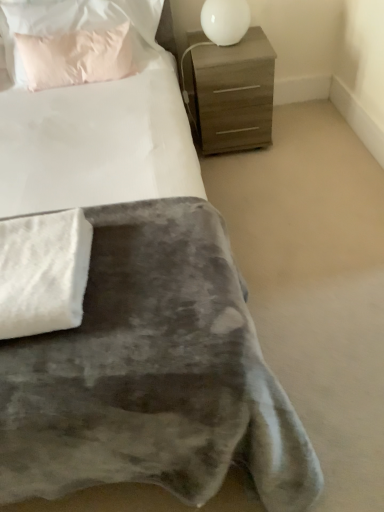
Question: Is pink fabric pillow at upper left aimed at white fluffy blanket at lower left?

Choices:
 (A) yes
 (B) no

Answer: (A)

Question: Is pink fabric pillow at upper left to the right of white fluffy blanket at lower left from the viewer's perspective?

Choices:
 (A) no
 (B) yes

Answer: (A)

Question: Is pink fabric pillow at upper left positioned behind white fluffy blanket at lower left?

Choices:
 (A) no
 (B) yes

Answer: (B)

Question: Considering the relative sizes of pink fabric pillow at upper left and white fluffy blanket at lower left in the image provided, is pink fabric pillow at upper left thinner than white fluffy blanket at lower left?

Choices:
 (A) yes
 (B) no

Answer: (A)

Question: Is pink fabric pillow at upper left not inside white fluffy blanket at lower left?

Choices:
 (A) yes
 (B) no

Answer: (A)

Question: Considering the relative positions of white glossy table lamp at upper right and white fluffy blanket at lower left in the image provided, is white glossy table lamp at upper right to the left or to the right of white fluffy blanket at lower left?

Choices:
 (A) left
 (B) right

Answer: (B)

Question: From the image's perspective, relative to white fluffy blanket at lower left, is white glossy table lamp at upper right above or below?

Choices:
 (A) above
 (B) below

Answer: (A)

Question: In the image, is white glossy table lamp at upper right positioned in front of or behind white fluffy blanket at lower left?

Choices:
 (A) behind
 (B) front

Answer: (A)

Question: Considering the positions of white glossy table lamp at upper right and white fluffy blanket at lower left in the image, is white glossy table lamp at upper right bigger or smaller than white fluffy blanket at lower left?

Choices:
 (A) small
 (B) big

Answer: (B)

Question: Is white fluffy blanket at lower left inside the boundaries of matte brown chest of drawers at upper right, or outside?

Choices:
 (A) outside
 (B) inside

Answer: (A)

Question: Does point (18, 249) appear closer or farther from the camera than point (190, 91)?

Choices:
 (A) farther
 (B) closer

Answer: (B)

Question: Considering the positions of white fluffy blanket at lower left and matte brown chest of drawers at upper right in the image, is white fluffy blanket at lower left wider or thinner than matte brown chest of drawers at upper right?

Choices:
 (A) wide
 (B) thin

Answer: (B)

Question: Based on their sizes in the image, would you say white fluffy blanket at lower left is bigger or smaller than matte brown chest of drawers at upper right?

Choices:
 (A) small
 (B) big

Answer: (A)

Question: Considering the positions of white fluffy blanket at lower left and white glossy table lamp at upper right in the image, is white fluffy blanket at lower left wider or thinner than white glossy table lamp at upper right?

Choices:
 (A) thin
 (B) wide

Answer: (B)

Question: In terms of height, does white fluffy blanket at lower left look taller or shorter compared to white glossy table lamp at upper right?

Choices:
 (A) short
 (B) tall

Answer: (A)